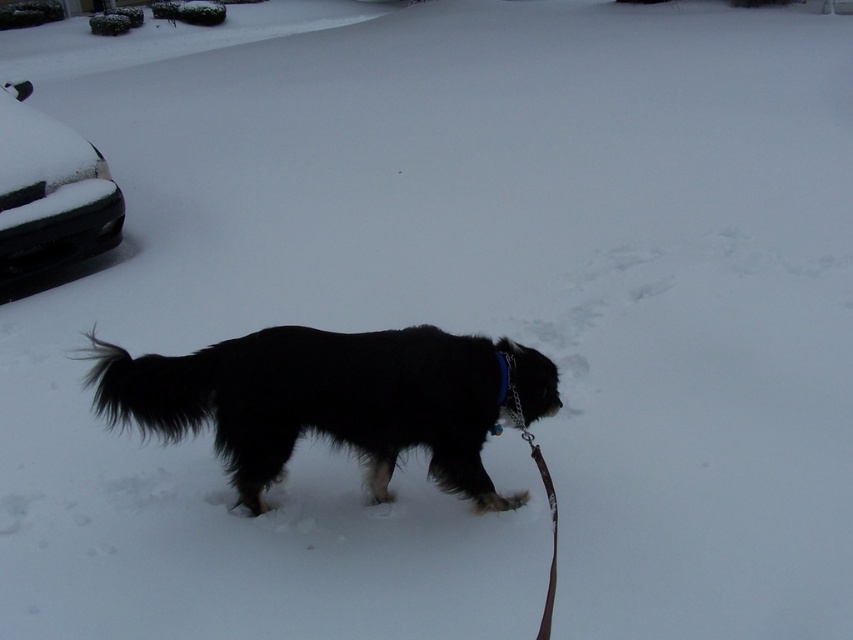
You are a dog owner who wants to ensure your black fluffy dog at center has enough space to move around while on the brown leather leash at lower center. Given that the leash is 1 meter long, can the dog comfortably move without feeling restricted?

The black fluffy dog at center is wider than the brown leather leash at lower center. Since the leash is 1 meter long, the dog can move comfortably within that length as its width does not restrict movement along the leash.

You are standing at the center of the snowy scene and want to reach the black glossy car at left. Which direction should you move to get there?

The black glossy car at left is located at point (x=49, y=193), so you should move to the left to reach it.